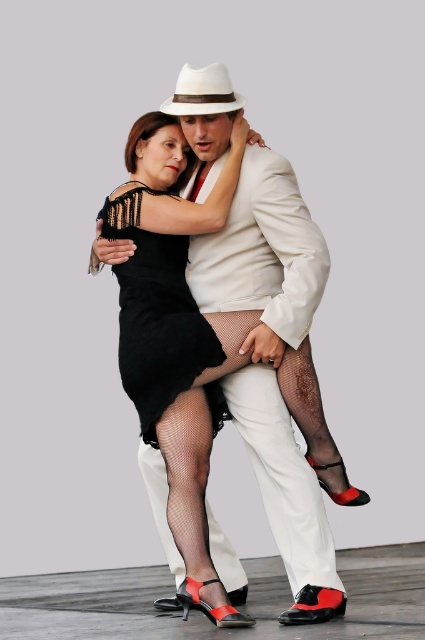
In the scene shown: How much distance is there between matte black dress at center and fishnet stockings at center?

matte black dress at center is 6.90 inches from fishnet stockings at center.

Based on the photo, does matte black dress at center have a smaller size compared to fishnet stockings at center?

No.

At what (x,y) coordinates should I click in order to perform the action: click on matte black dress at center. Please return your answer as a coordinate pair (x, y). Looking at the image, I should click on (275, 365).

The width and height of the screenshot is (425, 640). In order to click on matte black dress at center in this screenshot , I will do `click(275, 365)`.

Is fishnet stockings at center positioned at the back of black mesh dress at center?

No, it is in front of black mesh dress at center.

In the scene shown: Does fishnet stockings at center have a greater height compared to black mesh dress at center?

Correct, fishnet stockings at center is much taller as black mesh dress at center.

Find the location of `fishnet stockings at center`. fishnet stockings at center is located at coordinates (283, 476).

Between black mesh dress at center and white felt fedora at center, which one is positioned higher?

white felt fedora at center is above.

The image size is (425, 640). What do you see at coordinates (155, 316) in the screenshot?
I see `black mesh dress at center` at bounding box center [155, 316].

Between point (119, 275) and point (181, 108), which one is positioned in front?

Positioned in front is point (181, 108).

This screenshot has width=425, height=640. Identify the location of black mesh dress at center. (155, 316).